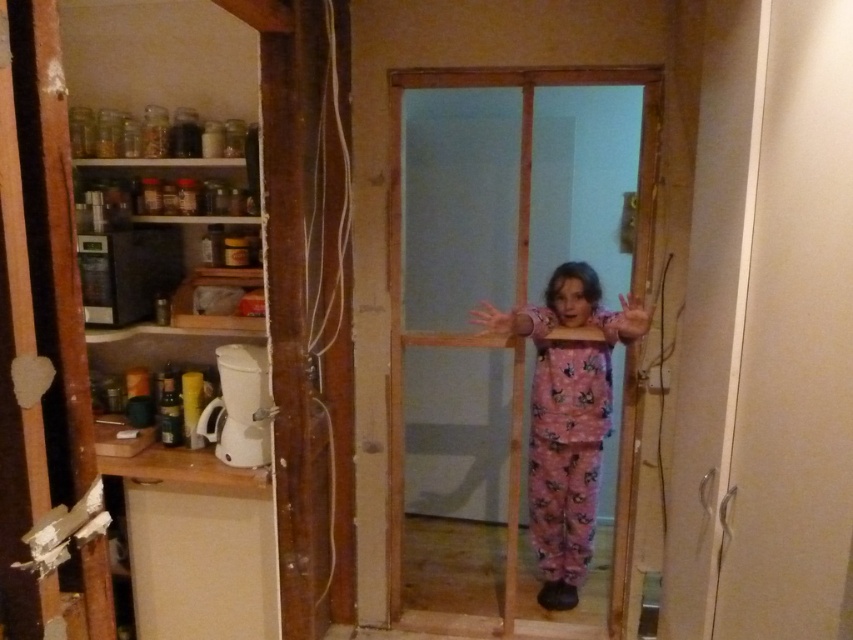
Question: Which of the following is the farthest from the observer?

Choices:
 (A) (585, 561)
 (B) (32, 48)
 (C) (548, 451)

Answer: (A)

Question: Which object is positioned farthest from the white matte pantry at left?

Choices:
 (A) pink fuzzy jumpsuit at center
 (B) pink cotton pajamas at center

Answer: (A)

Question: Which point appears closest to the camera in this image?

Choices:
 (A) (332, 323)
 (B) (637, 246)
 (C) (552, 456)

Answer: (B)

Question: Is white matte pantry at left above pink fuzzy jumpsuit at center?

Choices:
 (A) yes
 (B) no

Answer: (A)

Question: Can you confirm if white matte pantry at left is positioned to the right of pink cotton pajamas at center?

Choices:
 (A) no
 (B) yes

Answer: (A)

Question: Does pink cotton pajamas at center appear on the right side of pink fuzzy jumpsuit at center?

Choices:
 (A) no
 (B) yes

Answer: (A)